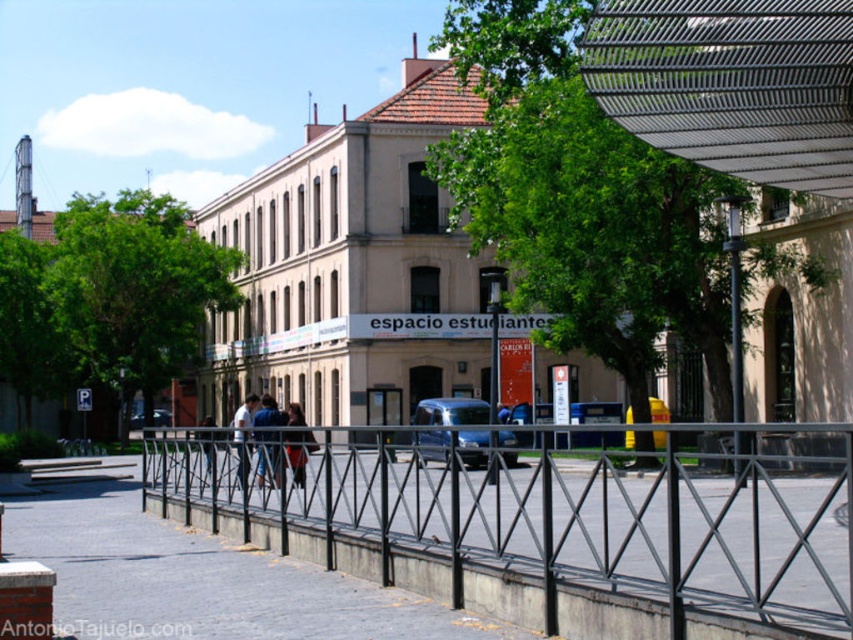
Question: From the image, what is the correct spatial relationship of black metal fence at center in relation to blue metallic van at center?

Choices:
 (A) right
 (B) left

Answer: (B)

Question: Estimate the real-world distances between objects in this image. Which object is closer to the light blue jeans at center?

Choices:
 (A) blue metallic van at center
 (B) blue denim jeans at center

Answer: (B)

Question: Is gray concrete pavement at center smaller than dark brown leather jacket at center?

Choices:
 (A) yes
 (B) no

Answer: (B)

Question: Which object appears closest to the camera in this image?

Choices:
 (A) black metal fence at center
 (B) gray concrete pavement at center
 (C) dark brown leather jacket at center
 (D) blue denim jeans at center

Answer: (A)

Question: Which of the following is the farthest from the observer?

Choices:
 (A) blue metallic van at center
 (B) dark blue jeans at center

Answer: (B)

Question: Can you confirm if dark brown leather jacket at center is positioned to the right of light blue jeans at center?

Choices:
 (A) no
 (B) yes

Answer: (B)